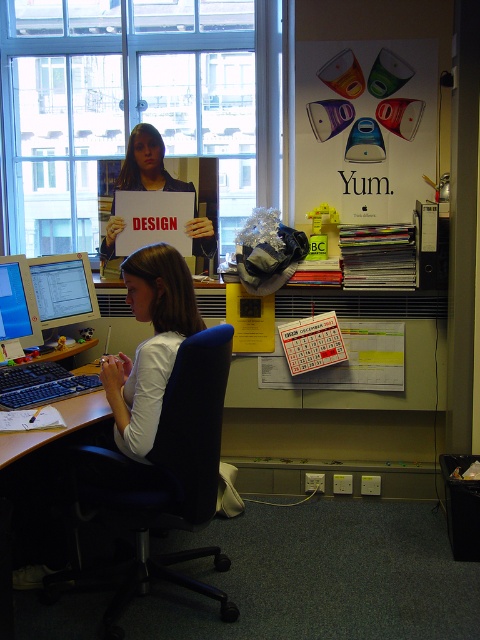
You are an office worker who needs to reach both the matte black sign at center and the black plastic keyboard at lower left. Which object is closer to you?

The matte black sign at center is closer to you because it is further to the viewer than the black plastic keyboard at lower left, meaning it is nearer in your line of sight.

You are an office worker who needs to move a box from the blue fabric swivel chair at center to the matte black sign at center. Which object should you move first to create space?

The blue fabric swivel chair at center might be wider than the matte black sign at center, so you should move the blue fabric swivel chair at center first to create more space.

You are standing in an office and need to sit down quickly. There is a blue fabric swivel chair at center. Can you reach it without moving more than 2 meters?

The blue fabric swivel chair at center and viewer are 2.02 meters apart from each other, so you cannot reach it without moving more than 2 meters.